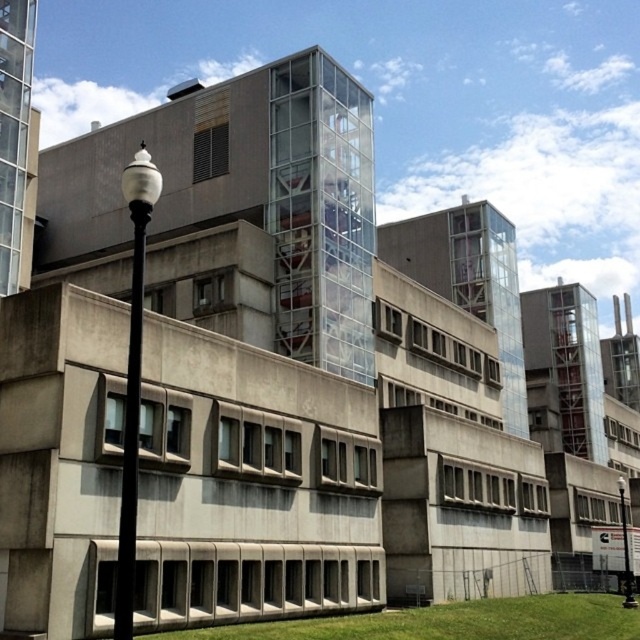
Does green grass at lower center appear under black metal/texture lamp post at left?

Indeed, green grass at lower center is positioned under black metal/texture lamp post at left.

Is green grass at lower center above black metal/texture lamp post at left?

Actually, green grass at lower center is below black metal/texture lamp post at left.

Find the location of a particular element. The image size is (640, 640). green grass at lower center is located at coordinates (449, 621).

Between black metal/texture lamp post at left and black glass lamp post at lower right, which one appears on the left side from the viewer's perspective?

From the viewer's perspective, black metal/texture lamp post at left appears more on the left side.

Between black metal/texture lamp post at left and black glass lamp post at lower right, which one is positioned higher?

black metal/texture lamp post at left is above.

This screenshot has height=640, width=640. Identify the location of black metal/texture lamp post at left. (132, 381).

Measure the distance between point (388, 637) and camera.

Point (388, 637) is 40.57 meters from camera.

Does green grass at lower center appear on the left side of black glass lamp post at lower right?

Indeed, green grass at lower center is positioned on the left side of black glass lamp post at lower right.

Is point (608, 618) closer to camera compared to point (620, 492)?

Yes.

Locate an element on the screen. green grass at lower center is located at coordinates (449, 621).